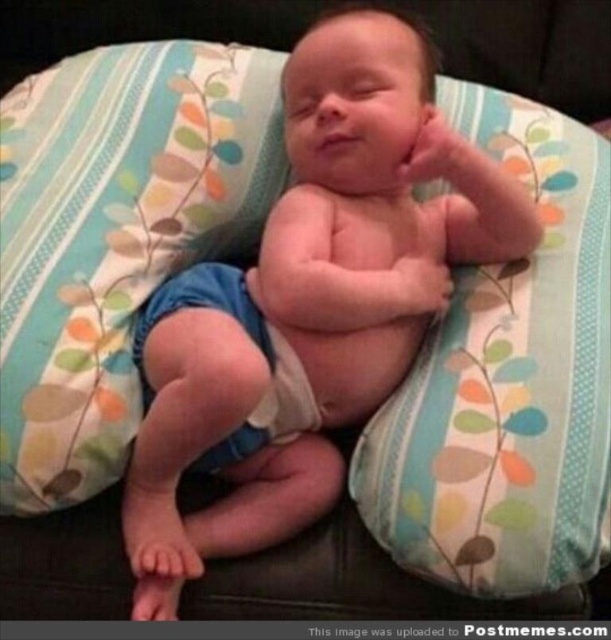
Question: Can you confirm if smooth skin baby at center is positioned below blue fabric diaper at center?

Choices:
 (A) yes
 (B) no

Answer: (B)

Question: Is the position of smooth skin baby at center less distant than that of fluffy fabric pillow at center?

Choices:
 (A) yes
 (B) no

Answer: (B)

Question: Which point is farther to the camera?

Choices:
 (A) blue fabric pillow at center
 (B) smooth skin baby at center

Answer: (A)

Question: Can you confirm if smooth skin baby at center is smaller than blue fabric pillow at center?

Choices:
 (A) yes
 (B) no

Answer: (B)

Question: Among these points, which one is nearest to the camera?

Choices:
 (A) (521, 417)
 (B) (371, 145)
 (C) (16, 193)
 (D) (235, 308)

Answer: (A)

Question: Which of these objects is positioned farthest from the fluffy fabric pillow at center?

Choices:
 (A) blue fabric pillow at center
 (B) blue fabric diaper at center

Answer: (A)